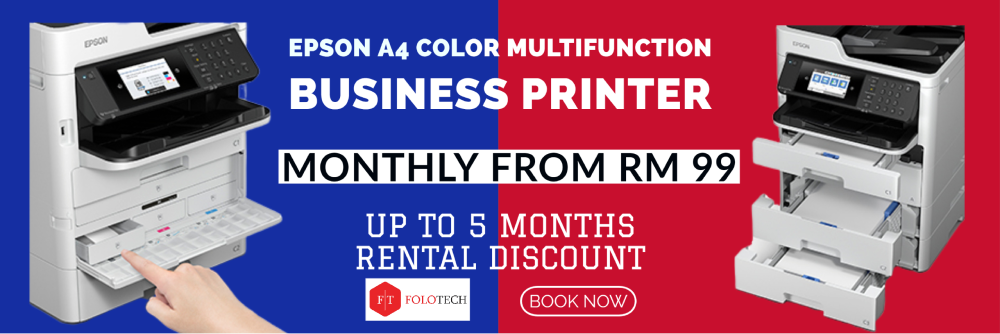
Identify the location of printers. (117, 186), (924, 131).